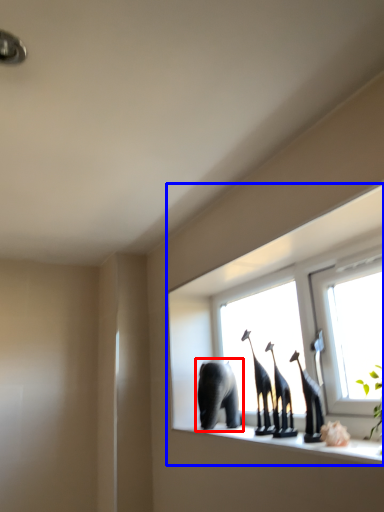
Question: Among these objects, which one is farthest to the camera, elephant (highlighted by a red box) or window (highlighted by a blue box)?

Choices:
 (A) elephant
 (B) window

Answer: (A)